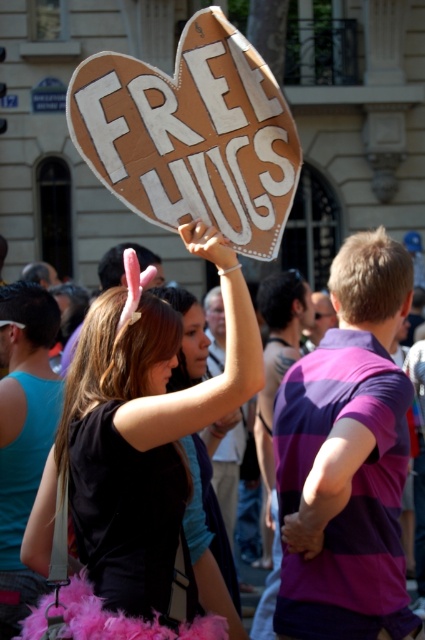
Does cardboard heart at center have a smaller size compared to black feather boa at center?

Correct, cardboard heart at center occupies less space than black feather boa at center.

Which of these two, cardboard heart at center or black feather boa at center, stands shorter?

cardboard heart at center is shorter.

The image size is (425, 640). I want to click on cardboard heart at center, so click(192, 134).

The image size is (425, 640). What are the coordinates of `cardboard heart at center` in the screenshot? It's located at (192, 134).

Is matte pink feather at center positioned at the back of matte cardboard sign at upper center?

No, matte pink feather at center is closer to the viewer.

Between matte pink feather at center and matte cardboard sign at upper center, which one has more height?

matte pink feather at center is taller.

I want to click on matte pink feather at center, so click(306, 528).

Which of these two, cardboard heart at center or matte pink feather at center, stands taller?

cardboard heart at center is taller.

Where is `cardboard heart at center`? This screenshot has width=425, height=640. cardboard heart at center is located at coordinates (192, 134).